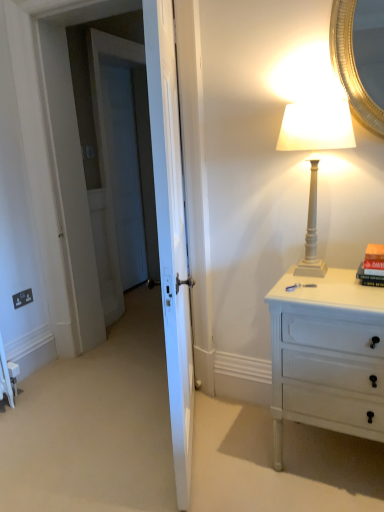
What is the approximate height of white painted wood chest of drawers at right?

The height of white painted wood chest of drawers at right is 31.52 inches.

The image size is (384, 512). What do you see at coordinates (372, 266) in the screenshot?
I see `hardcover book at right` at bounding box center [372, 266].

You are a GUI agent. You are given a task and a screenshot of the screen. Output one action in this format:
    pyautogui.click(x=<x>, y=<y>)
    Task: Click on the white glossy door at center
    The height and width of the screenshot is (512, 384).
    Given the screenshot: What is the action you would take?
    pyautogui.click(x=171, y=232)

You are a GUI agent. You are given a task and a screenshot of the screen. Output one action in this format:
    pyautogui.click(x=<x>, y=<y>)
    Task: Click on the black plastic electric outlet at lower left
    Image resolution: width=384 pixels, height=512 pixels.
    Given the screenshot: What is the action you would take?
    pyautogui.click(x=22, y=298)

Identify the location of white painted wood chest of drawers at right. (327, 356).

Does white matte lamp at upper right have a lesser height compared to black plastic electric outlet at lower left?

Incorrect, the height of white matte lamp at upper right does not fall short of that of black plastic electric outlet at lower left.

Can you confirm if white matte lamp at upper right is bigger than black plastic electric outlet at lower left?

Yes.

Which object is more forward, white matte lamp at upper right or black plastic electric outlet at lower left?

white matte lamp at upper right is closer to the camera.

From the image's perspective, is white matte lamp at upper right above black plastic electric outlet at lower left?

Correct, white matte lamp at upper right appears higher than black plastic electric outlet at lower left in the image.

Is black plastic electric outlet at lower left completely or partially inside white painted wood chest of drawers at right?

Definitely not — black plastic electric outlet at lower left is not inside white painted wood chest of drawers at right.

Is white painted wood chest of drawers at right oriented towards black plastic electric outlet at lower left?

No, white painted wood chest of drawers at right does not turn towards black plastic electric outlet at lower left.

Who is shorter, white painted wood chest of drawers at right or black plastic electric outlet at lower left?

black plastic electric outlet at lower left is shorter.

Which point is more distant from viewer, (x=367, y=434) or (x=30, y=291)?

Point (x=30, y=291)

Would you say white painted wood chest of drawers at right is outside white matte lamp at upper right?

white painted wood chest of drawers at right is positioned outside white matte lamp at upper right.

Between white painted wood chest of drawers at right and white matte lamp at upper right, which one has larger width?

Wider between the two is white painted wood chest of drawers at right.

Is white matte lamp at upper right at the back of white painted wood chest of drawers at right?

No, white painted wood chest of drawers at right is not facing away from white matte lamp at upper right.

Does white painted wood chest of drawers at right have a larger size compared to white matte lamp at upper right?

→ Yes, white painted wood chest of drawers at right is bigger than white matte lamp at upper right.

From their relative heights in the image, would you say white matte lamp at upper right is taller or shorter than white painted wood chest of drawers at right?

In the image, white matte lamp at upper right appears to be shorter than white painted wood chest of drawers at right.

What's the angular difference between white matte lamp at upper right and white painted wood chest of drawers at right's facing directions?

The angle between the facing direction of white matte lamp at upper right and the facing direction of white painted wood chest of drawers at right is 0.566 degrees.

Which is in front, point (350, 143) or point (303, 296)?

The point (303, 296) is closer to the camera.

Is white matte lamp at upper right positioned far away from white painted wood chest of drawers at right?

white matte lamp at upper right is actually quite close to white painted wood chest of drawers at right.

Does white glossy door at center appear on the right side of black plastic electric outlet at lower left?

Indeed, white glossy door at center is positioned on the right side of black plastic electric outlet at lower left.

From a real-world perspective, is white glossy door at center positioned over black plastic electric outlet at lower left based on gravity?

Yes, from a real-world perspective, white glossy door at center is on top of black plastic electric outlet at lower left.

Is white glossy door at center located outside black plastic electric outlet at lower left?

Yes.

Is there a large distance between white glossy door at center and black plastic electric outlet at lower left?

Yes, white glossy door at center is far from black plastic electric outlet at lower left.

Considering the sizes of hardcover book at right and white painted wood chest of drawers at right in the image, is hardcover book at right bigger or smaller than white painted wood chest of drawers at right?

In the image, hardcover book at right appears to be smaller than white painted wood chest of drawers at right.

From the image's perspective, is hardcover book at right located above or below white painted wood chest of drawers at right?

From the image's perspective, hardcover book at right appears above white painted wood chest of drawers at right.

From a real-world perspective, who is located lower, hardcover book at right or white painted wood chest of drawers at right?

In real-world perspective, white painted wood chest of drawers at right is lower.

Locate an element on the screen. chest of drawers below the hardcover book at right (from a real-world perspective) is located at coordinates (327, 356).

Is black plastic electric outlet at lower left far away from hardcover book at right?

Yes.

Measure the distance from black plastic electric outlet at lower left to hardcover book at right.

black plastic electric outlet at lower left and hardcover book at right are 2.02 meters apart.

From the image's perspective, which object appears higher, black plastic electric outlet at lower left or hardcover book at right?

hardcover book at right is shown above in the image.

Which of these two, black plastic electric outlet at lower left or hardcover book at right, stands shorter?

Standing shorter between the two is black plastic electric outlet at lower left.

Where is `electric outlet below the white matte lamp at upper right (from a real-world perspective)`? This screenshot has width=384, height=512. electric outlet below the white matte lamp at upper right (from a real-world perspective) is located at coordinates (22, 298).

Image resolution: width=384 pixels, height=512 pixels. I want to click on chest of drawers in front of the black plastic electric outlet at lower left, so point(327,356).

Considering their positions, is white painted wood chest of drawers at right positioned closer to hardcover book at right than black plastic electric outlet at lower left?

white painted wood chest of drawers at right lies closer to hardcover book at right than the other object.

Which object lies further to the anchor point black plastic electric outlet at lower left, white matte lamp at upper right or white painted wood chest of drawers at right?

Among the two, white matte lamp at upper right is located further to black plastic electric outlet at lower left.

In the scene shown: When comparing their distances from black plastic electric outlet at lower left, does hardcover book at right or white matte lamp at upper right seem further?

hardcover book at right.

From the picture: When comparing their distances from white painted wood chest of drawers at right, does black plastic electric outlet at lower left or white glossy door at center seem closer?

white glossy door at center.

Looking at the image, which one is located closer to hardcover book at right, white matte lamp at upper right or white painted wood chest of drawers at right?

Among the two, white painted wood chest of drawers at right is located nearer to hardcover book at right.

Based on their spatial positions, is white matte lamp at upper right or black plastic electric outlet at lower left further from hardcover book at right?

black plastic electric outlet at lower left is further to hardcover book at right.

When comparing their distances from white glossy door at center, does hardcover book at right or white painted wood chest of drawers at right seem closer?

The object closer to white glossy door at center is white painted wood chest of drawers at right.

Considering their positions, is hardcover book at right positioned further to white painted wood chest of drawers at right than white glossy door at center?

white glossy door at center is positioned further to the anchor white painted wood chest of drawers at right.

Where is `door situated between black plastic electric outlet at lower left and white matte lamp at upper right from left to right`? This screenshot has height=512, width=384. door situated between black plastic electric outlet at lower left and white matte lamp at upper right from left to right is located at coordinates (171, 232).

The image size is (384, 512). I want to click on the chest of drawers located between white glossy door at center and hardcover book at right in the left-right direction, so click(x=327, y=356).

The height and width of the screenshot is (512, 384). Find the location of `door located between black plastic electric outlet at lower left and white painted wood chest of drawers at right in the left-right direction`. door located between black plastic electric outlet at lower left and white painted wood chest of drawers at right in the left-right direction is located at coordinates (171, 232).

Find the location of a particular element. This screenshot has width=384, height=512. bedside lamp between white glossy door at center and hardcover book at right from left to right is located at coordinates (316, 126).